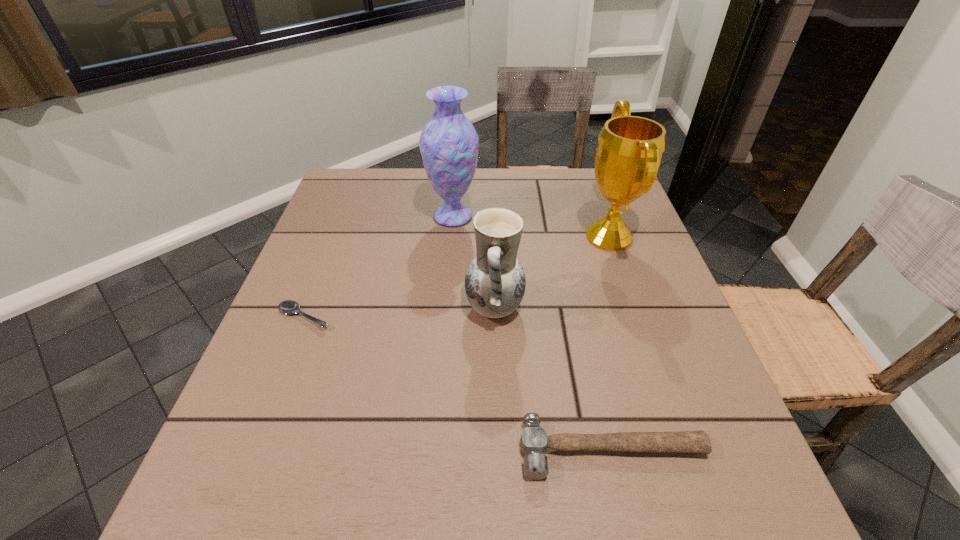
Image resolution: width=960 pixels, height=540 pixels. Find the location of `free space between the award and the vase`. free space between the award and the vase is located at coordinates (531, 226).

Select which object appears as the fourth closest to the pottery. Please provide its 2D coordinates. Your answer should be formatted as a tuple, i.e. [(x, y)], where the tuple contains the x and y coordinates of a point satisfying the conditions above.

[(288, 307)]

Identify the location of the closest object to the third shortest object. Image resolution: width=960 pixels, height=540 pixels. (630, 149).

Identify the location of blank area in the image that satisfies the following two spatial constraints: 1. on the front-facing side of the award; 2. on the striking face of the fourth tallest object. The image size is (960, 540). (683, 449).

Locate an element on the screen. The image size is (960, 540). free space that satisfies the following two spatial constraints: 1. on the front-facing side of the award; 2. on the front side of the leftmost object is located at coordinates (636, 316).

Where is `free space that satisfies the following two spatial constraints: 1. on the front-facing side of the award; 2. on the striking face of the nearest object`? The image size is (960, 540). free space that satisfies the following two spatial constraints: 1. on the front-facing side of the award; 2. on the striking face of the nearest object is located at coordinates (683, 449).